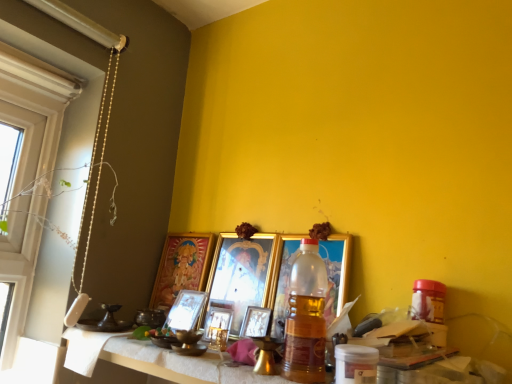
At what (x,y) coordinates should I click in order to perform the action: click on gold metallic picture frame at center, the third picture frame viewed from the right. Please return your answer as a coordinate pair (x, y). The image size is (512, 384). Looking at the image, I should click on (242, 273).

How much space does gold metallic picture frame at center, placed as the first picture frame when sorted from right to left, occupy vertically?

It is 27.04 centimeters.

Image resolution: width=512 pixels, height=384 pixels. What do you see at coordinates (158, 359) in the screenshot? I see `white textured table at lower center` at bounding box center [158, 359].

This screenshot has height=384, width=512. Describe the element at coordinates (42, 183) in the screenshot. I see `white matte window at left` at that location.

In order to click on gold metallic picture frame at center, which appears as the fourth picture frame when viewed from the left in this screenshot , I will do `click(242, 273)`.

Between gold-framed picture at center, the 1th picture frame when ordered from left to right, and white matte window at left, which one has more height?

white matte window at left.

Could white matte window at left be considered to be inside gold-framed picture at center, the 1th picture frame when ordered from left to right?

That's incorrect, white matte window at left is not inside gold-framed picture at center, the 1th picture frame when ordered from left to right.

Which is behind, point (194, 261) or point (41, 140)?

Point (41, 140)

Is the position of gold-framed picture at center, acting as the sixth picture frame starting from the right, more distant than that of white matte window at left?

Yes, gold-framed picture at center, acting as the sixth picture frame starting from the right, is further from the camera.

Based on the photo, which of these two, metallic gold picture frame at center, which is counted as the 4th picture frame, starting from the right, or translucent plastic bottle at center, is smaller?

With smaller size is metallic gold picture frame at center, which is counted as the 4th picture frame, starting from the right.

Considering the points (205, 329) and (300, 341), which point is in front, point (205, 329) or point (300, 341)?

Point (300, 341)

What are the coordinates of `bottle that appears above the metallic gold picture frame at center, placed as the third picture frame when sorted from left to right (from the image's perspective)` in the screenshot? It's located at (306, 317).

From the image's perspective, is metallic gold picture frame at center, which is counted as the 4th picture frame, starting from the right, under translucent plastic bottle at center?

Correct, metallic gold picture frame at center, which is counted as the 4th picture frame, starting from the right, appears lower than translucent plastic bottle at center in the image.

How different are the orientations of translucent plastic bottle at center and white textured table at lower center in degrees?

They differ by 1.13 degrees in their facing directions.

Can you confirm if translucent plastic bottle at center is positioned to the right of white textured table at lower center?

Indeed, translucent plastic bottle at center is positioned on the right side of white textured table at lower center.

Which is behind, translucent plastic bottle at center or white textured table at lower center?

translucent plastic bottle at center is more distant.

Is translucent plastic bottle at center looking in the opposite direction of white textured table at lower center?

No, translucent plastic bottle at center is not facing the opposite direction of white textured table at lower center.

From the image's perspective, would you say gold metallic picture frame at center, the third picture frame viewed from the right, is shown under metallic gold picture frame at center, the 2th picture frame when ordered from right to left?

Incorrect, from the image's perspective, gold metallic picture frame at center, the third picture frame viewed from the right, is higher than metallic gold picture frame at center, the 2th picture frame when ordered from right to left.

What's the angular difference between gold metallic picture frame at center, the third picture frame viewed from the right, and metallic gold picture frame at center, arranged as the 5th picture frame when viewed from the left,'s facing directions?

5.89 degrees separate the facing orientations of gold metallic picture frame at center, the third picture frame viewed from the right, and metallic gold picture frame at center, arranged as the 5th picture frame when viewed from the left.

Based on their positions, is gold metallic picture frame at center, which appears as the fourth picture frame when viewed from the left, located to the left or right of metallic gold picture frame at center, the 2th picture frame when ordered from right to left?

From the image, it's evident that gold metallic picture frame at center, which appears as the fourth picture frame when viewed from the left, is to the left of metallic gold picture frame at center, the 2th picture frame when ordered from right to left.

Between point (233, 302) and point (258, 307), which one is positioned behind?

The point (233, 302) is farther from the camera.

Consider the image. Could you tell me if gold metallic picture frame at center, placed as the first picture frame when sorted from right to left, is facing metallic gold picture frame at center, which is counted as the 4th picture frame, starting from the right?

No, gold metallic picture frame at center, placed as the first picture frame when sorted from right to left, is not aimed at metallic gold picture frame at center, which is counted as the 4th picture frame, starting from the right.

How distant is gold metallic picture frame at center, placed as the first picture frame when sorted from right to left, from metallic gold picture frame at center, placed as the third picture frame when sorted from left to right?

gold metallic picture frame at center, placed as the first picture frame when sorted from right to left, is 7.38 inches away from metallic gold picture frame at center, placed as the third picture frame when sorted from left to right.

Can you tell me how much gold metallic picture frame at center, placed as the first picture frame when sorted from right to left, and metallic gold picture frame at center, which is counted as the 4th picture frame, starting from the right, differ in facing direction?

5.89 degrees separate the facing orientations of gold metallic picture frame at center, placed as the first picture frame when sorted from right to left, and metallic gold picture frame at center, which is counted as the 4th picture frame, starting from the right.

Which of these two, gold metallic picture frame at center, marked as the 6th picture frame in a left-to-right arrangement, or metallic gold picture frame at center, which is counted as the 4th picture frame, starting from the right, stands shorter?

With less height is metallic gold picture frame at center, which is counted as the 4th picture frame, starting from the right.

From the image's perspective, which is above, metallic gold picture frame at center, arranged as the 5th picture frame when viewed from the left, or translucent plastic bottle at center?

translucent plastic bottle at center is shown above in the image.

Considering the relative sizes of metallic gold picture frame at center, arranged as the 5th picture frame when viewed from the left, and translucent plastic bottle at center in the image provided, is metallic gold picture frame at center, arranged as the 5th picture frame when viewed from the left, bigger than translucent plastic bottle at center?

Actually, metallic gold picture frame at center, arranged as the 5th picture frame when viewed from the left, might be smaller than translucent plastic bottle at center.

From a real-world perspective, starting from the translucent plastic bottle at center, which picture frame is the 2nd one below it? Please provide its 2D coordinates.

[(255, 322)]

Which of these two, metallic gold picture frame at center, the 2th picture frame when ordered from right to left, or translucent plastic bottle at center, is wider?

translucent plastic bottle at center is wider.

Are metallic gold picture frame at center, placed as the third picture frame when sorted from left to right, and white textured table at lower center far apart?

metallic gold picture frame at center, placed as the third picture frame when sorted from left to right, is near white textured table at lower center, not far away.

Based on the photo, is metallic gold picture frame at center, which is counted as the 4th picture frame, starting from the right, shorter than white textured table at lower center?

No, metallic gold picture frame at center, which is counted as the 4th picture frame, starting from the right, is not shorter than white textured table at lower center.

From the image's perspective, is metallic gold picture frame at center, placed as the third picture frame when sorted from left to right, located above or below white textured table at lower center?

metallic gold picture frame at center, placed as the third picture frame when sorted from left to right, is above white textured table at lower center.

From a real-world perspective, between metallic gold picture frame at center, which is counted as the 4th picture frame, starting from the right, and white textured table at lower center, who is vertically higher?

From a 3D spatial view, metallic gold picture frame at center, which is counted as the 4th picture frame, starting from the right, is above.

This screenshot has height=384, width=512. I want to click on the 1st picture frame counting from the right of the white matte window at left, so click(x=181, y=267).

You are a GUI agent. You are given a task and a screenshot of the screen. Output one action in this format:
    pyautogui.click(x=<x>, y=<y>)
    Task: Click on the picture frame that is the 5th object located below the translucent plastic bottle at center (from the image's perspective)
    This screenshot has height=384, width=512.
    Given the screenshot: What is the action you would take?
    pyautogui.click(x=217, y=320)

Considering their positions, is white textured table at lower center positioned further to gold-framed picture at center, acting as the sixth picture frame starting from the right, than metallic gold picture frame at center, arranged as the 5th picture frame when viewed from the left?

white textured table at lower center.

Estimate the real-world distances between objects in this image. Which object is further from pearl-like beads at left, metallic gold picture frame at center, the 2th picture frame when ordered from right to left, or gold-framed picture at center, acting as the sixth picture frame starting from the right?

metallic gold picture frame at center, the 2th picture frame when ordered from right to left, lies further to pearl-like beads at left than the other object.

Estimate the real-world distances between objects in this image. Which object is further from metallic silver picture frame at center, which is the second picture frame in left-to-right order, white matte window at left or gold-framed picture at center, acting as the sixth picture frame starting from the right?

The object further to metallic silver picture frame at center, which is the second picture frame in left-to-right order, is white matte window at left.

Based on their spatial positions, is translucent plastic bottle at center or white textured table at lower center closer to metallic gold picture frame at center, which is counted as the 4th picture frame, starting from the right?

white textured table at lower center is positioned closer to the anchor metallic gold picture frame at center, which is counted as the 4th picture frame, starting from the right.

Looking at the image, which one is located closer to metallic silver picture frame at center, which is the second picture frame in left-to-right order, gold-framed picture at center, acting as the sixth picture frame starting from the right, or metallic gold picture frame at center, placed as the third picture frame when sorted from left to right?

Among the two, metallic gold picture frame at center, placed as the third picture frame when sorted from left to right, is located nearer to metallic silver picture frame at center, which is the second picture frame in left-to-right order.

Based on their spatial positions, is pearl-like beads at left or white textured table at lower center closer to metallic gold picture frame at center, arranged as the 5th picture frame when viewed from the left?

Based on the image, white textured table at lower center appears to be nearer to metallic gold picture frame at center, arranged as the 5th picture frame when viewed from the left.

From the image, which object appears to be farther from white textured table at lower center, metallic gold picture frame at center, arranged as the 5th picture frame when viewed from the left, or gold metallic picture frame at center, the third picture frame viewed from the right?

gold metallic picture frame at center, the third picture frame viewed from the right, is further to white textured table at lower center.

Consider the image. Considering their positions, is metallic silver picture frame at center, which is the second picture frame in left-to-right order, positioned further to gold metallic picture frame at center, marked as the 6th picture frame in a left-to-right arrangement, than white textured table at lower center?

white textured table at lower center is further to gold metallic picture frame at center, marked as the 6th picture frame in a left-to-right arrangement.

The width and height of the screenshot is (512, 384). I want to click on table between white matte window at left and metallic gold picture frame at center, placed as the third picture frame when sorted from left to right, from front to back, so click(x=158, y=359).

The width and height of the screenshot is (512, 384). What are the coordinates of `bottle positioned between white textured table at lower center and gold-framed picture at center, the 1th picture frame when ordered from left to right, from near to far` in the screenshot? It's located at (306, 317).

The height and width of the screenshot is (384, 512). In order to click on string positioned between white textured table at lower center and gold-framed picture at center, the 1th picture frame when ordered from left to right, from near to far in this screenshot , I will do `click(96, 166)`.

This screenshot has height=384, width=512. I want to click on picture frame between gold-framed picture at center, the 1th picture frame when ordered from left to right, and metallic gold picture frame at center, which is counted as the 4th picture frame, starting from the right, from left to right, so click(x=185, y=310).